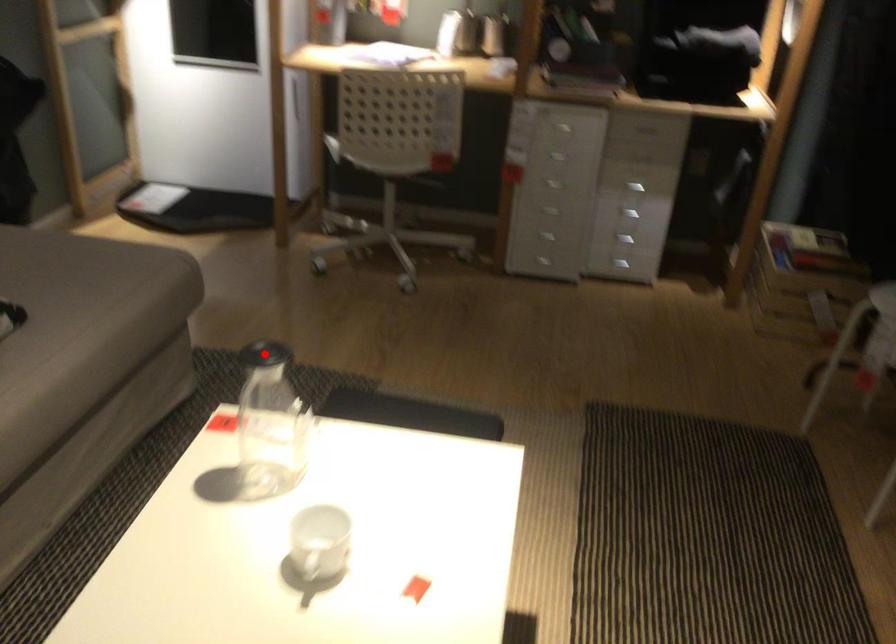
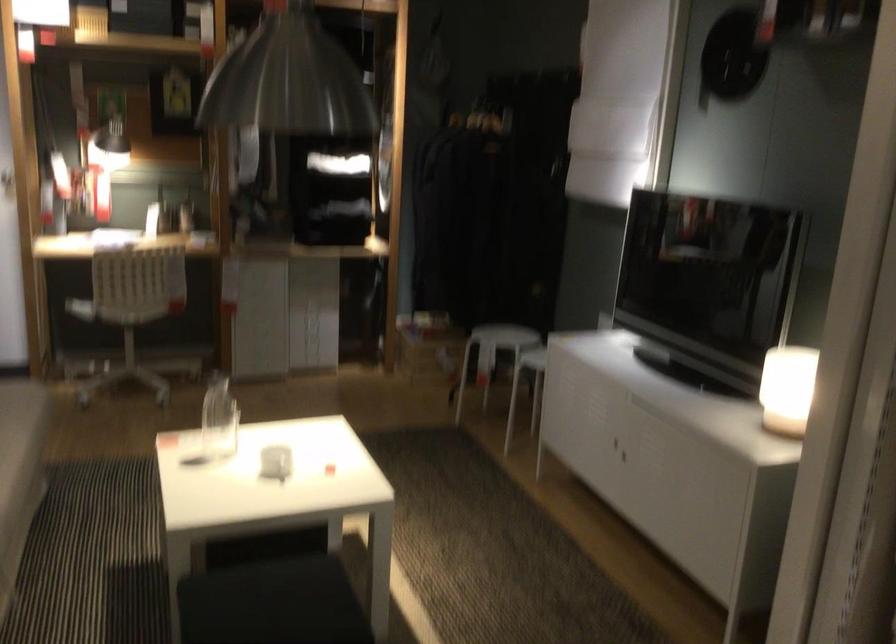
Question: A red point is marked in image1. In image2, is the corresponding 3D point closer to the camera or farther? Reply with the corresponding letter.

Choices:
 (A) The corresponding 3D point is closer.
 (B) The corresponding 3D point is farther.

Answer: (B)